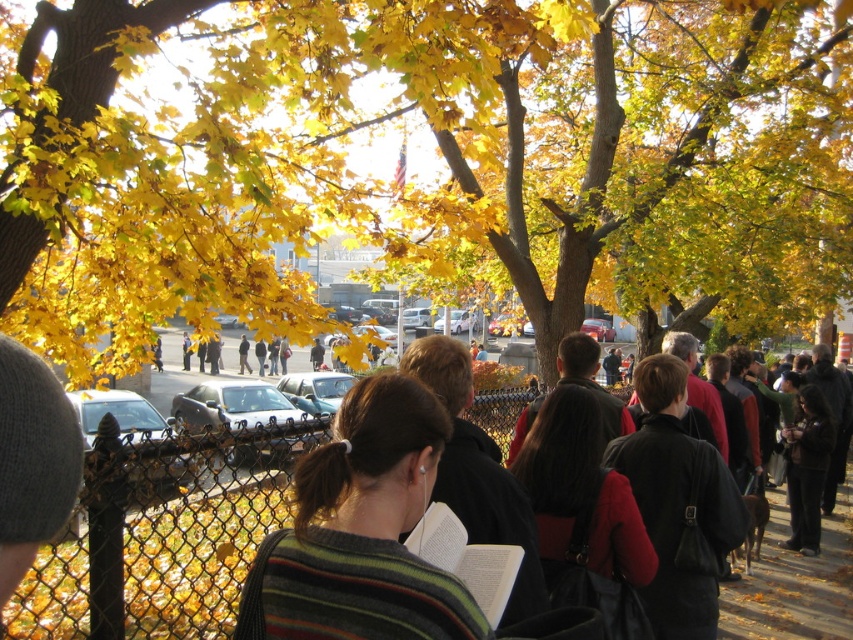
Locate an element on the screen. The height and width of the screenshot is (640, 853). dark red fabric bag at center is located at coordinates coord(584,515).

Who is positioned more to the right, dark red fabric bag at center or dark brown leather jacket at lower right?

dark brown leather jacket at lower right

The width and height of the screenshot is (853, 640). What are the coordinates of `dark red fabric bag at center` in the screenshot? It's located at (584, 515).

Does yellow leaves at upper center appear on the left side of dark brown leather jacket at lower right?

Indeed, yellow leaves at upper center is positioned on the left side of dark brown leather jacket at lower right.

The width and height of the screenshot is (853, 640). Describe the element at coordinates (439, 154) in the screenshot. I see `yellow leaves at upper center` at that location.

Who is more forward, (36, 342) or (811, 448)?

Point (36, 342)

Identify the location of yellow leaves at upper center. The image size is (853, 640). (439, 154).

Does yellow leaves at upper center appear on the left side of striped sweater at center?

No, yellow leaves at upper center is not to the left of striped sweater at center.

Between point (618, 141) and point (318, 550), which one is positioned in front?

Point (318, 550) is in front.

The image size is (853, 640). Find the location of `yellow leaves at upper center`. yellow leaves at upper center is located at coordinates (439, 154).